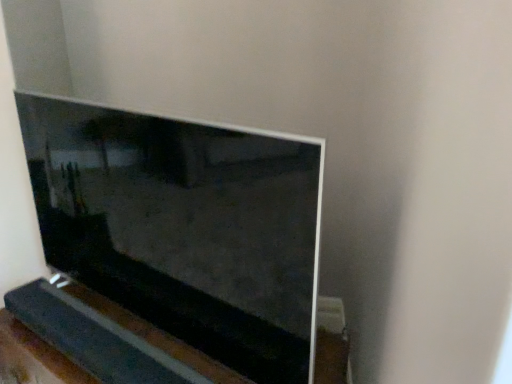
Question: From a real-world perspective, is black wood at lower left positioned above or below matte black television at center?

Choices:
 (A) below
 (B) above

Answer: (A)

Question: Considering their positions, is black wood at lower left located in front of or behind matte black television at center?

Choices:
 (A) front
 (B) behind

Answer: (B)

Question: Is point (38, 329) positioned closer to the camera than point (201, 178)?

Choices:
 (A) farther
 (B) closer

Answer: (A)

Question: Considering their positions, is matte black television at center located in front of or behind black wood at lower left?

Choices:
 (A) front
 (B) behind

Answer: (A)

Question: From a real-world perspective, relative to black wood at lower left, is matte black television at center vertically above or below?

Choices:
 (A) above
 (B) below

Answer: (A)

Question: Is matte black television at center situated inside black wood at lower left or outside?

Choices:
 (A) inside
 (B) outside

Answer: (B)

Question: Is matte black television at center wider or thinner than black wood at lower left?

Choices:
 (A) thin
 (B) wide

Answer: (B)